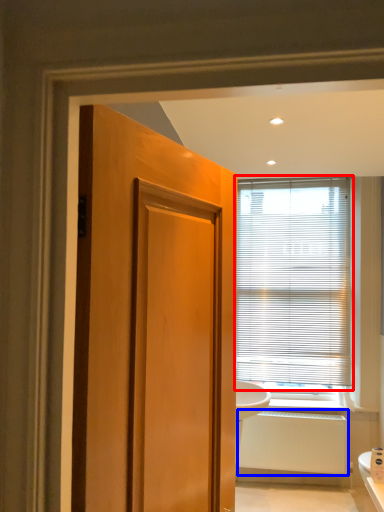
Question: Which object appears closest to the camera in this image, window blind (highlighted by a red box) or radiator (highlighted by a blue box)?

Choices:
 (A) window blind
 (B) radiator

Answer: (B)